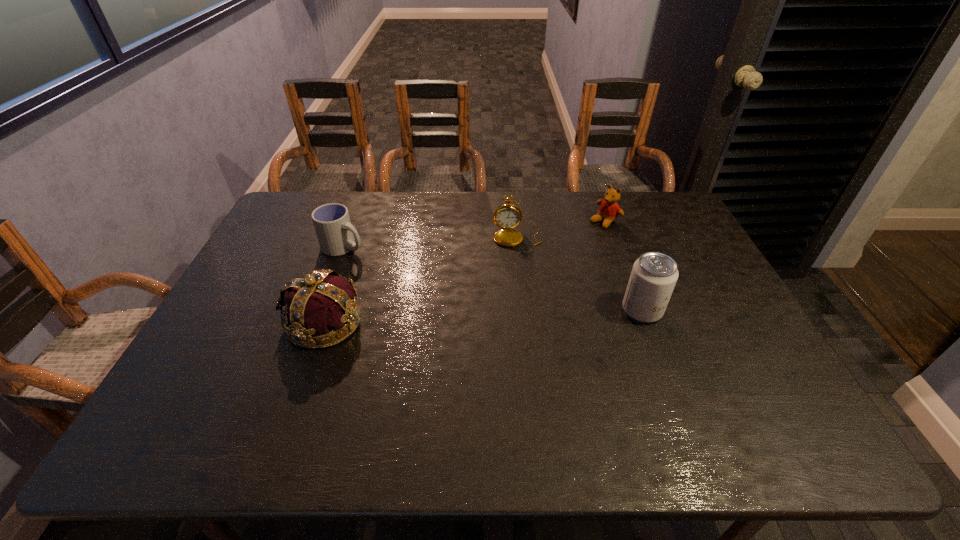
In order to click on free spot on the desktop that is between the crown and the soda can and is positioned on the face of the third object from left to right in this screenshot , I will do [x=532, y=314].

I want to click on free spot on the desktop that is between the crown and the soda can and is positioned with the handle on the side of the cup, so click(488, 316).

Where is `free spot on the desktop that is between the crown and the soda can and is positioned on the front-facing side of the teddy bear`? free spot on the desktop that is between the crown and the soda can and is positioned on the front-facing side of the teddy bear is located at coordinates (461, 317).